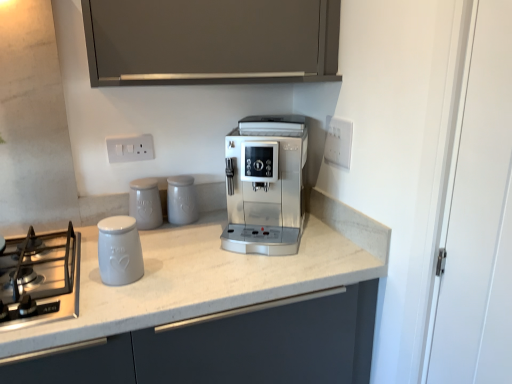
Question: Is white plastic electric outlet at upper center, positioned as the first electric outlet in left-to-right order, oriented away from white plastic electrical outlet at upper right, positioned as the second electric outlet in left-to-right order?

Choices:
 (A) no
 (B) yes

Answer: (A)

Question: Does white plastic electric outlet at upper center, which ranks as the 2th electric outlet in right-to-left order, have a greater width compared to white plastic electrical outlet at upper right, the first electric outlet from the right?

Choices:
 (A) yes
 (B) no

Answer: (A)

Question: Considering the relative positions of white plastic electric outlet at upper center, positioned as the first electric outlet in left-to-right order, and white plastic electrical outlet at upper right, the first electric outlet from the right, in the image provided, is white plastic electric outlet at upper center, positioned as the first electric outlet in left-to-right order, to the left of white plastic electrical outlet at upper right, the first electric outlet from the right, from the viewer's perspective?

Choices:
 (A) no
 (B) yes

Answer: (B)

Question: From the image's perspective, does white plastic electric outlet at upper center, which ranks as the 2th electric outlet in right-to-left order, appear higher than white plastic electrical outlet at upper right, the first electric outlet from the right?

Choices:
 (A) no
 (B) yes

Answer: (A)

Question: Considering the relative sizes of white plastic electric outlet at upper center, positioned as the first electric outlet in left-to-right order, and white plastic electrical outlet at upper right, the first electric outlet from the right, in the image provided, is white plastic electric outlet at upper center, positioned as the first electric outlet in left-to-right order, taller than white plastic electrical outlet at upper right, the first electric outlet from the right,?

Choices:
 (A) no
 (B) yes

Answer: (A)

Question: Is white marble countertop at center wider or thinner than white ceramic jar at center, the third kitchen appliance in the back-to-front sequence?

Choices:
 (A) thin
 (B) wide

Answer: (B)

Question: Is white marble countertop at center bigger or smaller than white ceramic jar at center, the third kitchen appliance in the back-to-front sequence?

Choices:
 (A) big
 (B) small

Answer: (A)

Question: From a real-world perspective, is white marble countertop at center above or below white ceramic jar at center, the third kitchen appliance in the back-to-front sequence?

Choices:
 (A) above
 (B) below

Answer: (B)

Question: Is white marble countertop at center in front of or behind white ceramic jar at center, the third kitchen appliance in the back-to-front sequence, in the image?

Choices:
 (A) front
 (B) behind

Answer: (A)

Question: In terms of width, does white ceramic jar at center, the 1th kitchen appliance from the front, look wider or thinner when compared to white plastic electrical outlet at upper right, the first electric outlet from the right?

Choices:
 (A) thin
 (B) wide

Answer: (B)

Question: Looking at the image, does white ceramic jar at center, the third kitchen appliance in the back-to-front sequence, seem bigger or smaller compared to white plastic electrical outlet at upper right, positioned as the second electric outlet in left-to-right order?

Choices:
 (A) big
 (B) small

Answer: (A)

Question: In the image, is white ceramic jar at center, the third kitchen appliance in the back-to-front sequence, positioned in front of or behind white plastic electrical outlet at upper right, positioned as the second electric outlet in left-to-right order?

Choices:
 (A) behind
 (B) front

Answer: (B)

Question: From a real-world perspective, is white ceramic jar at center, the 1th kitchen appliance from the front, physically located above or below white plastic electrical outlet at upper right, positioned as the second electric outlet in left-to-right order?

Choices:
 (A) below
 (B) above

Answer: (A)

Question: Considering the positions of point (138, 137) and point (9, 302), is point (138, 137) closer or farther from the camera than point (9, 302)?

Choices:
 (A) farther
 (B) closer

Answer: (A)

Question: From their relative heights in the image, would you say white plastic electric outlet at upper center, which ranks as the 2th electric outlet in right-to-left order, is taller or shorter than stainless steel gas stove at lower left?

Choices:
 (A) tall
 (B) short

Answer: (A)